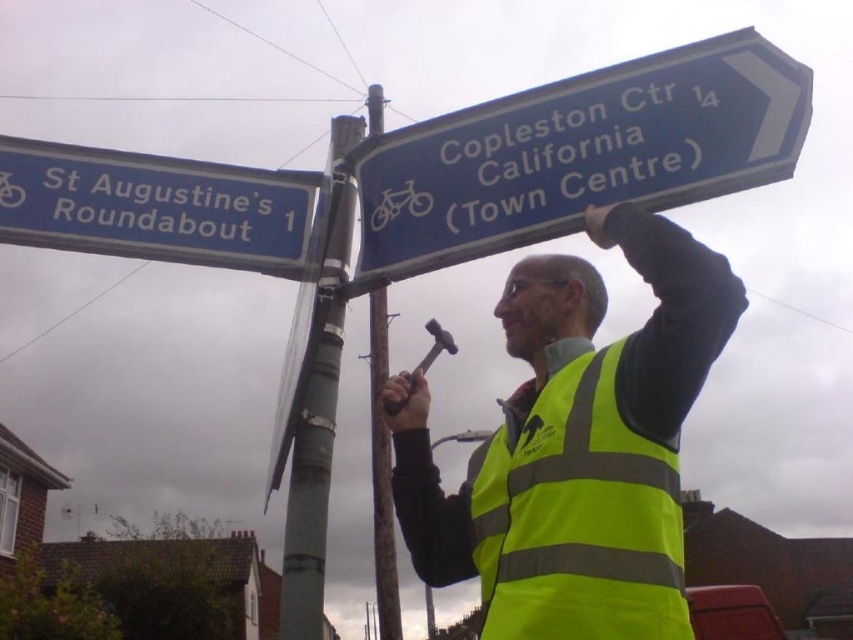
Is yellow reflective vest at upper center smaller than yellow reflective safety vest at center?

No.

Is point (524, 518) closer to viewer compared to point (643, 611)?

No.

I want to click on yellow reflective vest at upper center, so click(x=578, y=445).

Which is more to the right, blue plastic sign at upper right or gray metallic pole at center?

Positioned to the right is blue plastic sign at upper right.

Between point (577, 156) and point (314, 472), which one is positioned in front?

Point (577, 156) is more forward.

Where is `blue plastic sign at upper right`? Image resolution: width=853 pixels, height=640 pixels. blue plastic sign at upper right is located at coordinates (577, 154).

Is gray metallic pole at center above matte silver hammer at center?

No, gray metallic pole at center is not above matte silver hammer at center.

Who is higher up, gray metallic pole at center or matte silver hammer at center?

matte silver hammer at center

Does point (305, 323) come farther from viewer compared to point (445, 336)?

Yes, point (305, 323) is behind point (445, 336).

I want to click on gray metallic pole at center, so click(x=316, y=397).